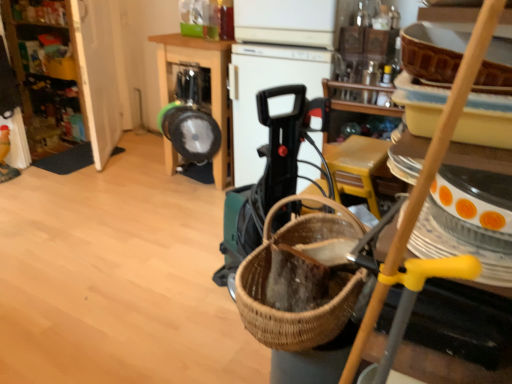
Identify the location of free space to the right of wooden cabinet at left. (135, 158).